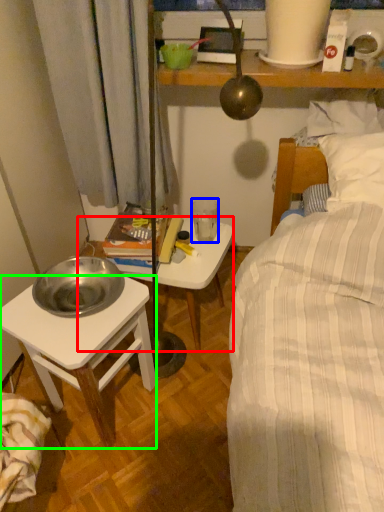
Question: Which object is the closest to the table (highlighted by a red box)? Choose among these: coffee cup (highlighted by a blue box) or desk (highlighted by a green box).

Choices:
 (A) coffee cup
 (B) desk

Answer: (A)